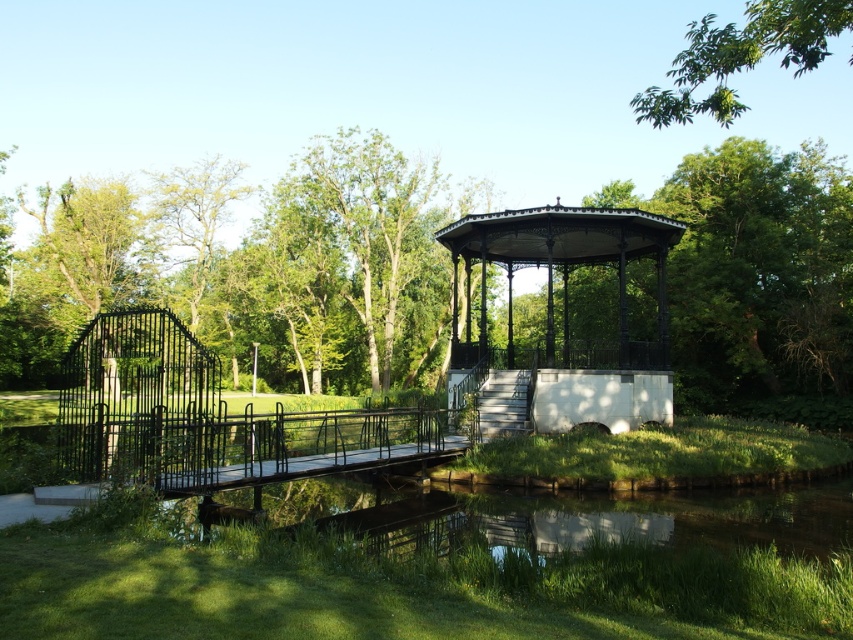
Question: Which point is farther to the camera?

Choices:
 (A) (831, 26)
 (B) (653, 356)
 (C) (41, 371)

Answer: (C)

Question: Which object appears farthest from the camera in this image?

Choices:
 (A) green leafy tree at left
 (B) green leafy tree at upper right
 (C) black wrought iron gazebo at center

Answer: (A)

Question: Which of the following is the farthest from the observer?

Choices:
 (A) green leafy tree at upper right
 (B) green leafy tree at upper center
 (C) black wrought iron gazebo at center

Answer: (B)

Question: Considering the relative positions of black wrought iron gazebo at center and green leafy tree at left in the image provided, where is black wrought iron gazebo at center located with respect to green leafy tree at left?

Choices:
 (A) above
 (B) below

Answer: (B)

Question: Is green leafy tree at upper center to the right of green leafy tree at upper right from the viewer's perspective?

Choices:
 (A) yes
 (B) no

Answer: (B)

Question: Is green leafy tree at upper center to the right of green leafy tree at left from the viewer's perspective?

Choices:
 (A) yes
 (B) no

Answer: (A)